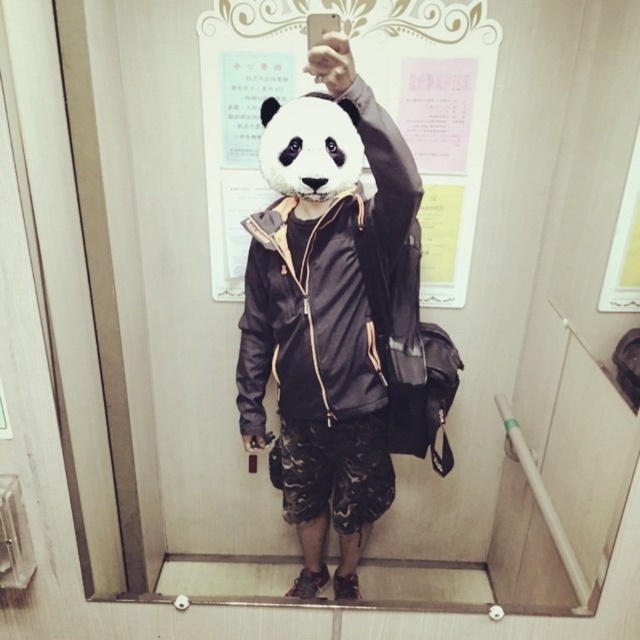
Consider the image. Is matte black jacket at center below white matte panda at center?

Indeed, matte black jacket at center is positioned under white matte panda at center.

Looking at this image, is matte black jacket at center taller than white matte panda at center?

Indeed, matte black jacket at center has a greater height compared to white matte panda at center.

Does point (371, 339) come farther from viewer compared to point (339, 108)?

Yes, point (371, 339) is farther from viewer.

The height and width of the screenshot is (640, 640). Find the location of `matte black jacket at center`. matte black jacket at center is located at coordinates (320, 257).

Is matte white paper at upper center below matte black jacket at center?

Incorrect, matte white paper at upper center is not positioned below matte black jacket at center.

Between matte white paper at upper center and matte black jacket at center, which one has more height?

matte black jacket at center is taller.

This screenshot has width=640, height=640. Find the location of `matte white paper at upper center`. matte white paper at upper center is located at coordinates (378, 100).

Where is `matte white paper at upper center`? The height and width of the screenshot is (640, 640). matte white paper at upper center is located at coordinates (378, 100).

Between matte white paper at upper center and white matte panda at center, which one appears on the right side from the viewer's perspective?

From the viewer's perspective, matte white paper at upper center appears more on the right side.

Is point (387, 33) closer to camera compared to point (317, 172)?

No.

Find the location of a particular element. The width and height of the screenshot is (640, 640). matte white paper at upper center is located at coordinates (378, 100).